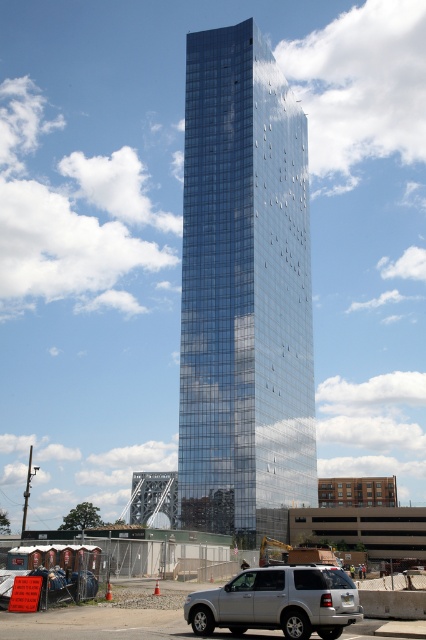
Question: Is glossy glass tower at center to the right of silver metallic suv at lower center from the viewer's perspective?

Choices:
 (A) yes
 (B) no

Answer: (A)

Question: Can you confirm if glossy glass tower at center is wider than silver metallic suv at lower center?

Choices:
 (A) yes
 (B) no

Answer: (A)

Question: Can you confirm if glossy glass tower at center is thinner than silver metallic suv at lower center?

Choices:
 (A) yes
 (B) no

Answer: (B)